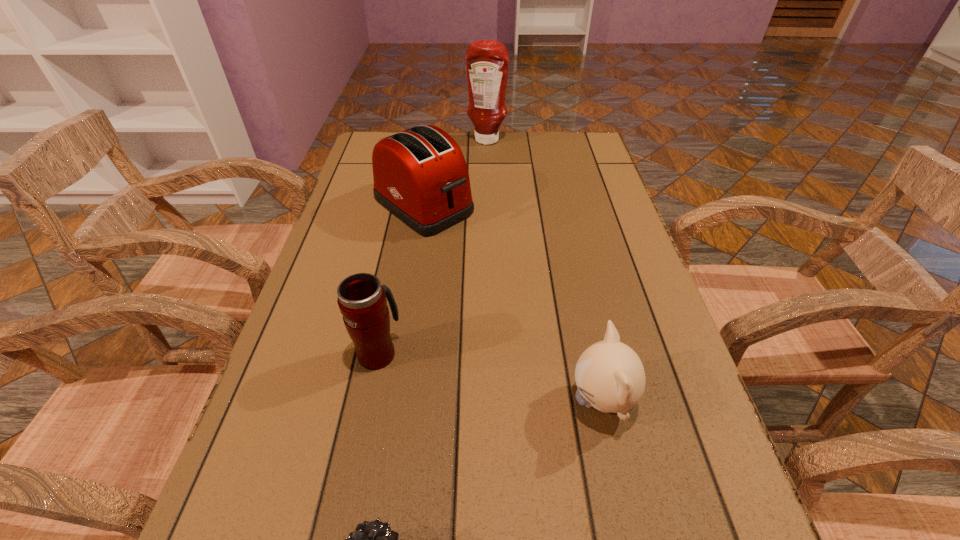
This screenshot has height=540, width=960. Identify the location of condiment. (487, 61).

Identify the location of the farthest object. (487, 61).

At what (x,y) coordinates should I click in order to perform the action: click on toaster. Please return your answer as a coordinate pair (x, y). The width and height of the screenshot is (960, 540). Looking at the image, I should click on (420, 175).

Identify the location of thermos bottle. (362, 301).

Locate an element on the screen. the fourth tallest object is located at coordinates (610, 377).

The image size is (960, 540). I want to click on kitten, so click(x=610, y=377).

Find the location of a particular element. Image resolution: width=960 pixels, height=540 pixels. blank area located 0.200m on the right of the farthest object is located at coordinates (567, 140).

Find the location of a particular element. The width and height of the screenshot is (960, 540). free space located 0.310m on the right of the toaster is located at coordinates (590, 205).

The width and height of the screenshot is (960, 540). I want to click on vacant space situated 0.130m on the side with the handle of the thermos bottle, so click(392, 287).

At what (x,y) coordinates should I click in order to perform the action: click on vacant space located on the side with the handle of the thermos bottle. Please return your answer as a coordinate pair (x, y). Looking at the image, I should click on (393, 284).